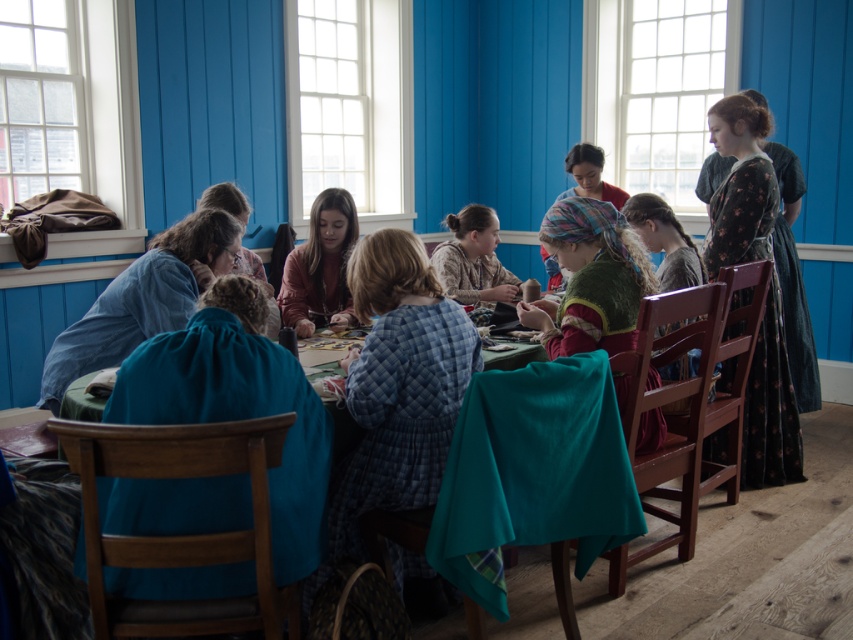
Question: In this image, where is velvet green dress at center located relative to floral dress at center?

Choices:
 (A) right
 (B) left

Answer: (B)

Question: Which object is the farthest from the floral-patterned fabric dress at right?

Choices:
 (A) multicolored fabric headscarf at center
 (B) blue quilted dress at center
 (C) floral dress at center
 (D) matte brown sweater at center

Answer: (B)

Question: Among these objects, which one is nearest to the camera?

Choices:
 (A) multicolored fabric headscarf at center
 (B) matte brown sweater at center
 (C) velvet green dress at center
 (D) floral fabric dress at center

Answer: (C)

Question: Which point is closer to the camera taking this photo?

Choices:
 (A) (587, 225)
 (B) (80, 360)
 (C) (703, 278)

Answer: (A)

Question: Can you confirm if velvet green dress at center is positioned to the right of floral fabric dress at center?

Choices:
 (A) yes
 (B) no

Answer: (A)

Question: Is velvet green dress at center to the left of multicolored fabric headscarf at center from the viewer's perspective?

Choices:
 (A) yes
 (B) no

Answer: (A)